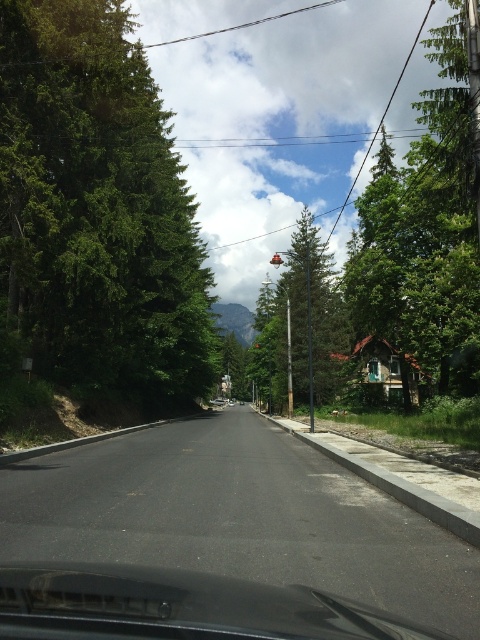
Question: Can you confirm if green leafy tree at left is positioned below green textured tree at center?

Choices:
 (A) yes
 (B) no

Answer: (A)

Question: From the image, what is the correct spatial relationship of green leafy tree at left in relation to green textured tree at center?

Choices:
 (A) right
 (B) left

Answer: (B)

Question: Which point is closer to the camera?

Choices:
 (A) (387, 198)
 (B) (44, 289)
 (C) (323, 250)
 (D) (48, 570)

Answer: (D)

Question: Which point is closer to the camera taking this photo?

Choices:
 (A) (476, 108)
 (B) (139, 269)
 (C) (332, 374)

Answer: (A)

Question: In this image, where is green leafy tree at upper center located relative to green textured tree at center?

Choices:
 (A) above
 (B) below

Answer: (A)

Question: Which object appears closest to the camera in this image?

Choices:
 (A) green leafy tree at upper center
 (B) green leafy tree at left
 (C) transparent glass windshield at center

Answer: (C)